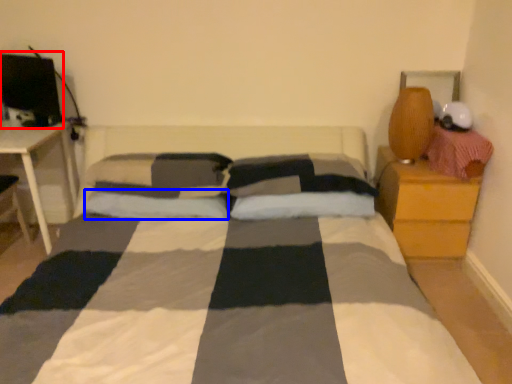
Question: Among these objects, which one is farthest to the camera, computer monitor (highlighted by a red box) or pillow (highlighted by a blue box)?

Choices:
 (A) computer monitor
 (B) pillow

Answer: (A)